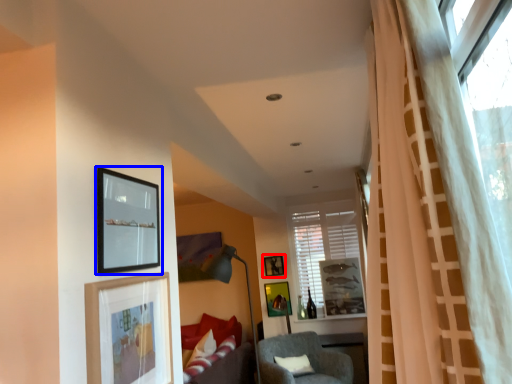
Question: Among these objects, which one is farthest to the camera, picture frame (highlighted by a red box) or picture frame (highlighted by a blue box)?

Choices:
 (A) picture frame
 (B) picture frame

Answer: (A)